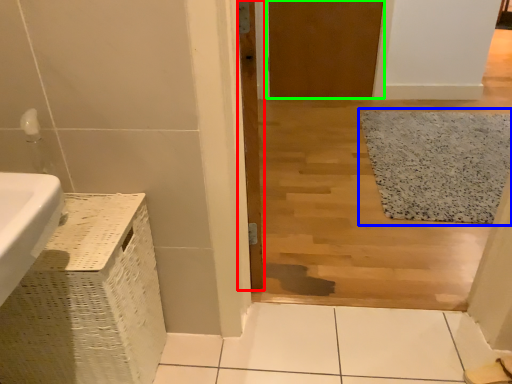
Question: Based on their relative distances, which object is nearer to door (highlighted by a red box)? Choose from bath mat (highlighted by a blue box) and door (highlighted by a green box).

Choices:
 (A) bath mat
 (B) door

Answer: (B)